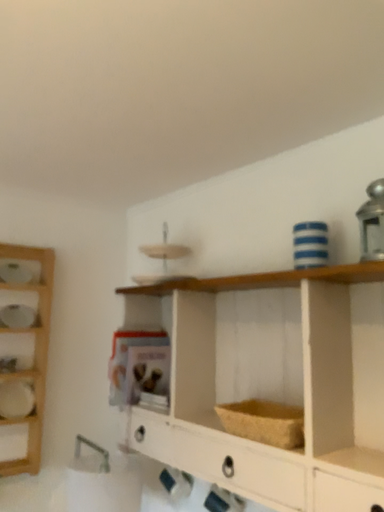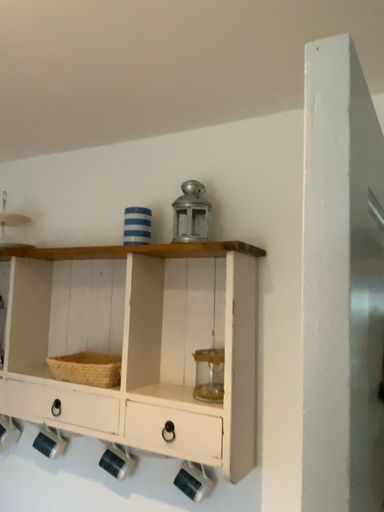
Question: How did the camera likely rotate when shooting the video?

Choices:
 (A) rotated right
 (B) rotated left

Answer: (A)